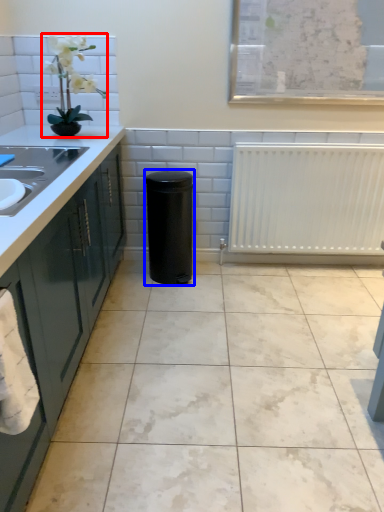
Question: Which of the following is the farthest to the observer, houseplant (highlighted by a red box) or appliance (highlighted by a blue box)?

Choices:
 (A) houseplant
 (B) appliance

Answer: (B)